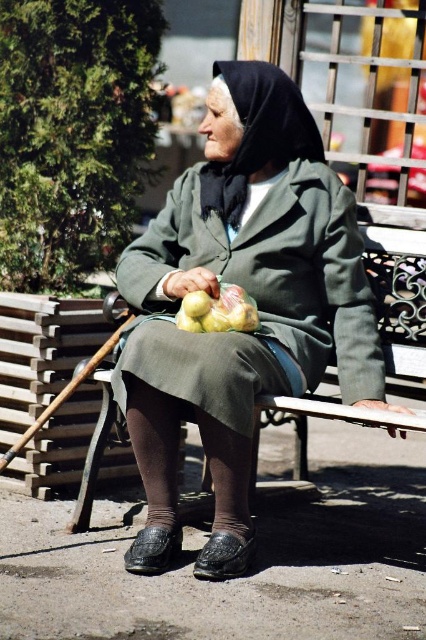
You are a delivery person who needs to place a small package between the matte green coat at center and the yellow matte apples at center. The package is 12 inches long. Can you fit it between them?

The distance between the matte green coat at center and the yellow matte apples at center is 11.61 inches. Since the package is 12 inches long, it cannot fit between them as the space is slightly smaller than the package.

The elderly woman is sitting on a wooden bench. There is a point labeled at coordinates (250, 294). What object is located at that point?

The point at coordinates (250, 294) corresponds to the matte green coat at center.

You are a customer at a local market and see the matte green coat at center and the yellow matte apples at center on the wooden bench. Which item is taller?

The matte green coat at center is taller than the yellow matte apples at center.